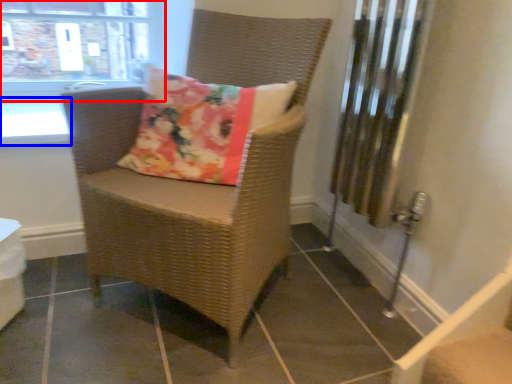
Question: Which point is closer to the camera, window (highlighted by a red box) or window sill (highlighted by a blue box)?

Choices:
 (A) window
 (B) window sill

Answer: (B)